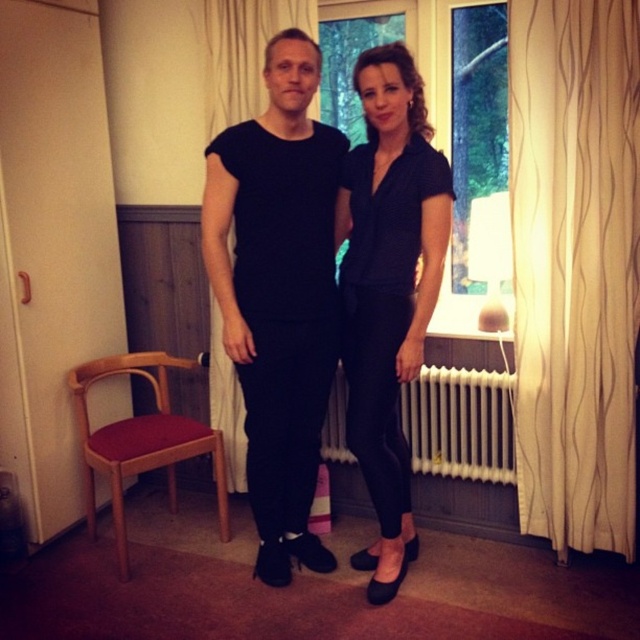
Question: Which point is closer to the camera?

Choices:
 (A) (125, 573)
 (B) (401, 52)

Answer: (B)

Question: Which is farther from the matte black blouse at center?

Choices:
 (A) black matte pants at center
 (B) wooden chair with red cushion at lower left
 (C) white sheer curtain at center
 (D) white metallic radiator at lower center

Answer: (C)

Question: Can you confirm if matte black blouse at center is positioned above wooden chair with red cushion at lower left?

Choices:
 (A) yes
 (B) no

Answer: (A)

Question: Is the position of black matte pants at center less distant than that of matte black blouse at center?

Choices:
 (A) no
 (B) yes

Answer: (A)

Question: Which object is farther from the camera taking this photo?

Choices:
 (A) wooden chair with red cushion at lower left
 (B) matte black blouse at center
 (C) beige textured curtain at right
 (D) black matte pants at center

Answer: (A)

Question: Does matte black blouse at center have a greater width compared to white metallic radiator at lower center?

Choices:
 (A) yes
 (B) no

Answer: (B)